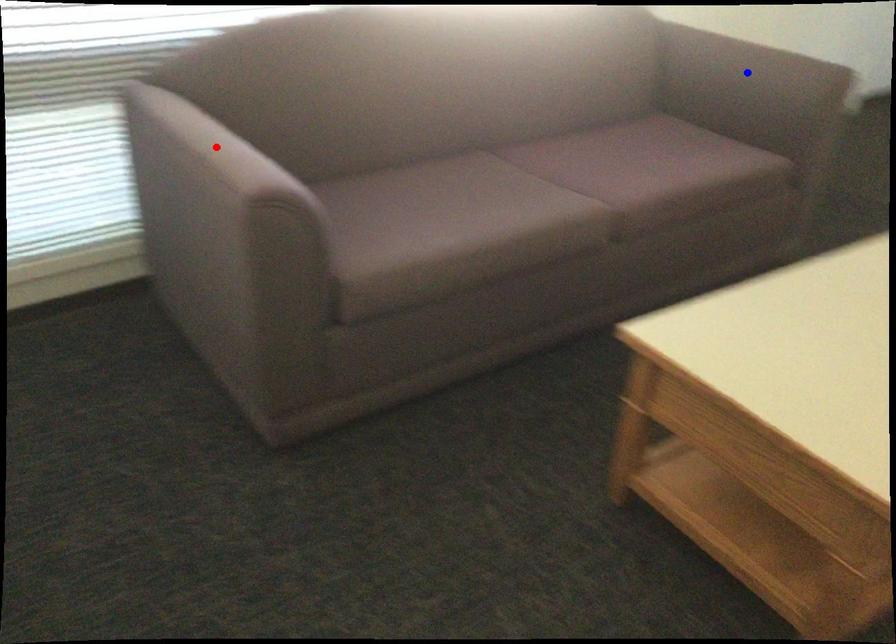
Question: Which of the two points in the image is closer to the camera?

Choices:
 (A) Blue point is closer.
 (B) Red point is closer.

Answer: (B)